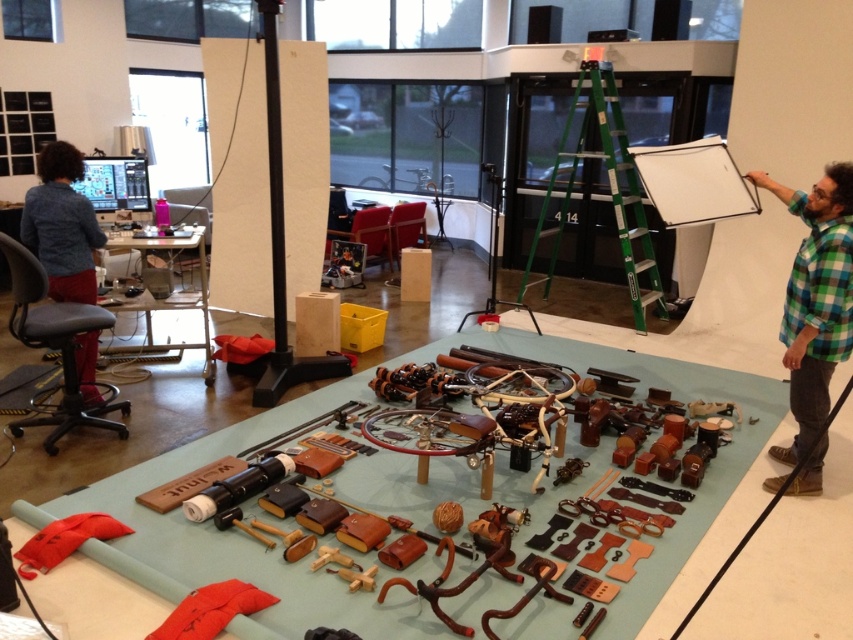
You are a photographer setting up for a shoot. You have a green metallic ladder at upper center and a blue denim shirt at left. Which object would you need to move if you want to create more space in the center of the image?

The green metallic ladder at upper center is larger in size than the blue denim shirt at left, so moving the green metallic ladder at upper center would create more space in the center of the image since it is the larger object.

In the scene shown: You are organizing a clothing display and need to arrange the green plaid shirt at right and the blue denim shirt at left. Based on their sizes, which shirt should be placed on a higher shelf to ensure visibility?

The green plaid shirt at right has a greater height compared to the blue denim shirt at left, so it should be placed on a higher shelf to ensure visibility.

You are a photographer setting up for a shoot. You notice the green plaid shirt at right and the green metallic ladder at upper center in your setup. Which object is positioned lower in the scene?

The green plaid shirt at right is located below the green metallic ladder at upper center, so the green plaid shirt at right is positioned lower in the scene.